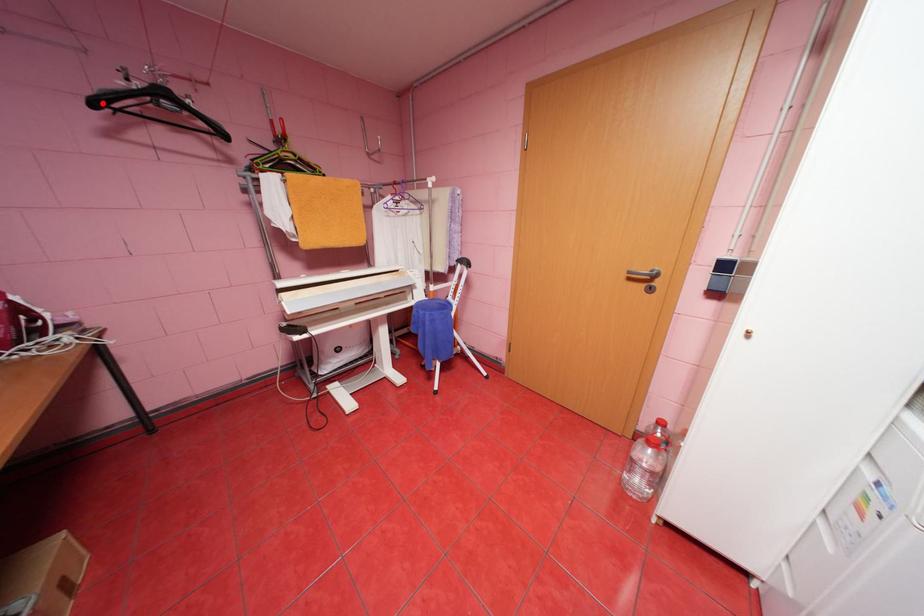
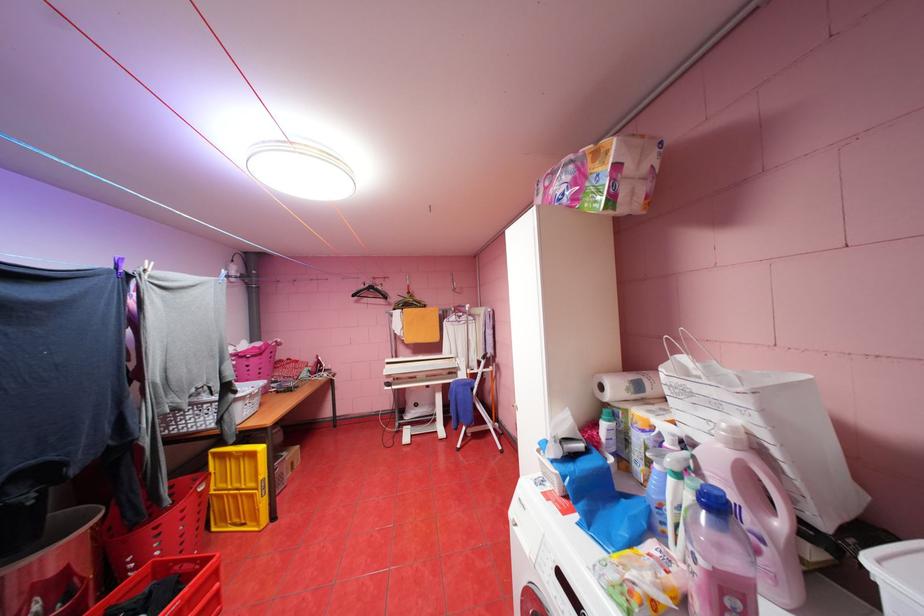
Question: I am providing you with two images of the same scene from different viewpoints. In image1, a red point is highlighted. Considering the same 3D point in image2, which of the following is correct?

Choices:
 (A) It is closer
 (B) It is farther

Answer: (A)